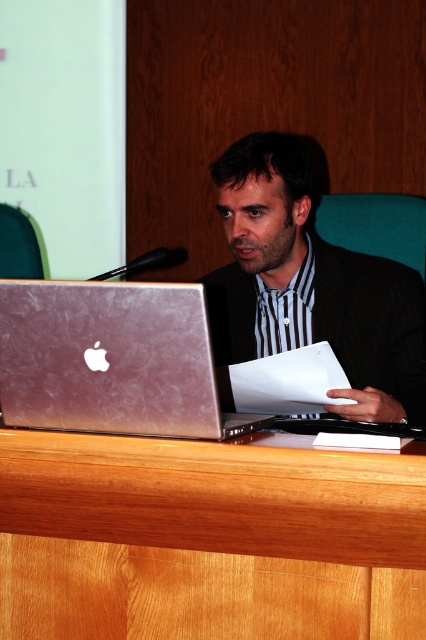
Can you confirm if matte black suit at center is positioned below green fabric chair at left?

Indeed, matte black suit at center is positioned under green fabric chair at left.

Which is in front, point (230, 209) or point (13, 264)?

Point (230, 209) is in front.

This screenshot has height=640, width=426. I want to click on matte black suit at center, so click(x=310, y=284).

Is point (321, 225) less distant than point (3, 246)?

That is True.

Does teal fabric chair at center have a lesser width compared to green fabric chair at left?

In fact, teal fabric chair at center might be wider than green fabric chair at left.

Measure the distance between teal fabric chair at center and camera.

teal fabric chair at center is 6.51 feet from camera.

In order to click on teal fabric chair at center in this screenshot , I will do `click(376, 225)`.

Does point (147, 292) lie behind point (34, 260)?

No.

Which is more to the right, silver metallic laptop at center or green fabric chair at left?

From the viewer's perspective, silver metallic laptop at center appears more on the right side.

Find the location of a particular element. silver metallic laptop at center is located at coordinates (111, 360).

At what (x,y) coordinates should I click in order to perform the action: click on silver metallic laptop at center. Please return your answer as a coordinate pair (x, y). Looking at the image, I should click on (111, 360).